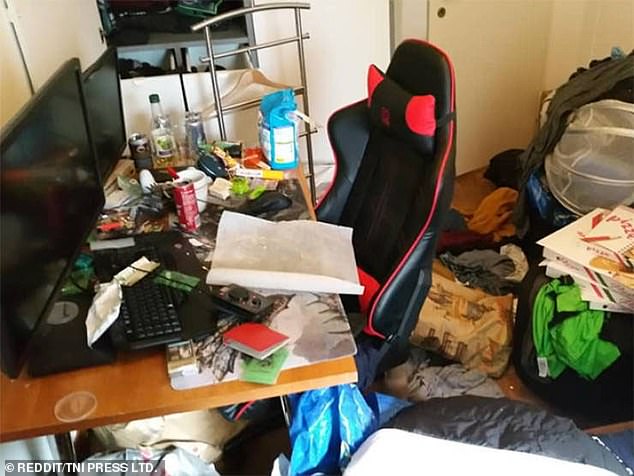
In order to click on screen in this screenshot , I will do `click(42, 209)`.